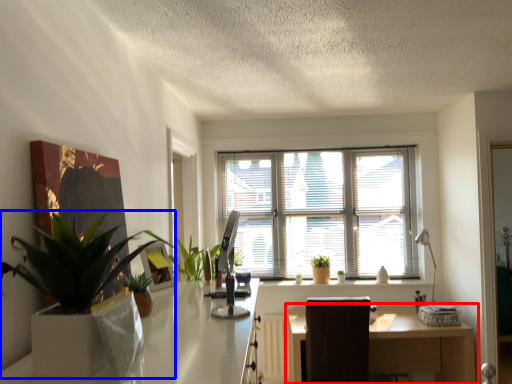
Question: Among these objects, which one is farthest to the camera, table (highlighted by a red box) or houseplant (highlighted by a blue box)?

Choices:
 (A) table
 (B) houseplant

Answer: (A)